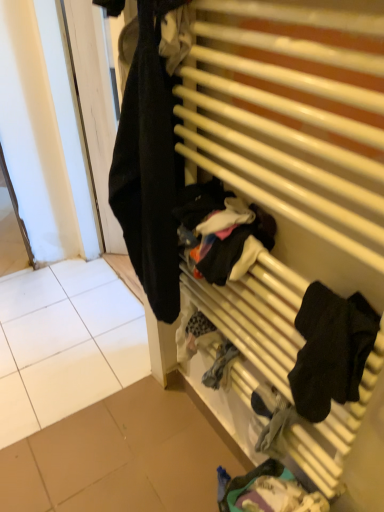
Question: Is black fabric socks at right, the 2th clothing from the top, behind white tile at left?

Choices:
 (A) no
 (B) yes

Answer: (A)

Question: Are black fabric socks at right, marked as the second clothing in a bottom-to-top arrangement, and white tile at left located far from each other?

Choices:
 (A) yes
 (B) no

Answer: (A)

Question: Is black fabric socks at right, marked as the second clothing in a bottom-to-top arrangement, shorter than white tile at left?

Choices:
 (A) yes
 (B) no

Answer: (B)

Question: Is black fabric socks at right, the 2th clothing from the top, facing away from white tile at left?

Choices:
 (A) no
 (B) yes

Answer: (A)

Question: Is black fabric socks at right, the 2th clothing from the top, at the left side of white tile at left?

Choices:
 (A) yes
 (B) no

Answer: (B)

Question: In terms of size, does white tile at left appear bigger or smaller than black fabric at left, the third clothing positioned from the bottom?

Choices:
 (A) big
 (B) small

Answer: (A)

Question: From the image's perspective, relative to black fabric at left, the third clothing positioned from the bottom, is white tile at left above or below?

Choices:
 (A) above
 (B) below

Answer: (B)

Question: From a real-world perspective, is white tile at left physically located above or below black fabric at left, the third clothing positioned from the bottom?

Choices:
 (A) above
 (B) below

Answer: (B)

Question: Considering the positions of point (79, 298) and point (155, 70), is point (79, 298) closer or farther from the camera than point (155, 70)?

Choices:
 (A) farther
 (B) closer

Answer: (A)

Question: Is dark blue fabric at lower center, the third clothing positioned from the top, bigger or smaller than black fabric at left, the third clothing positioned from the bottom?

Choices:
 (A) big
 (B) small

Answer: (B)

Question: From the image's perspective, is dark blue fabric at lower center, the third clothing positioned from the top, positioned above or below black fabric at left, the third clothing positioned from the bottom?

Choices:
 (A) above
 (B) below

Answer: (B)

Question: In the image, is dark blue fabric at lower center, positioned as the 1th clothing in bottom-to-top order, on the left side or the right side of black fabric at left, which is counted as the 1th clothing, starting from the top?

Choices:
 (A) left
 (B) right

Answer: (B)

Question: Considering the positions of dark blue fabric at lower center, positioned as the 1th clothing in bottom-to-top order, and black fabric at left, which is counted as the 1th clothing, starting from the top, in the image, is dark blue fabric at lower center, positioned as the 1th clothing in bottom-to-top order, wider or thinner than black fabric at left, which is counted as the 1th clothing, starting from the top,?

Choices:
 (A) thin
 (B) wide

Answer: (B)

Question: Is wooden radiator at right inside or outside of dark blue fabric at lower center, positioned as the 1th clothing in bottom-to-top order?

Choices:
 (A) outside
 (B) inside

Answer: (A)

Question: Looking at their shapes, would you say wooden radiator at right is wider or thinner than dark blue fabric at lower center, positioned as the 1th clothing in bottom-to-top order?

Choices:
 (A) thin
 (B) wide

Answer: (A)